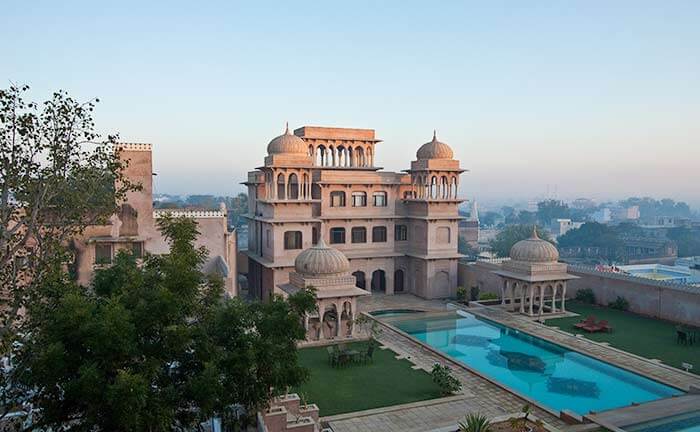
Locate an element on the screen. The height and width of the screenshot is (432, 700). wall is located at coordinates (642, 291).